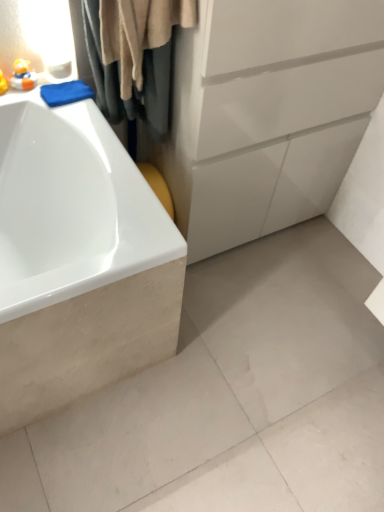
Question: Is white glossy bathtub at left looking in the opposite direction of matte yellow rubber duck at upper left, the first toy positioned from the left?

Choices:
 (A) yes
 (B) no

Answer: (B)

Question: From a real-world perspective, is white glossy bathtub at left over matte yellow rubber duck at upper left, the first toy positioned from the left?

Choices:
 (A) yes
 (B) no

Answer: (B)

Question: Is white glossy bathtub at left touching matte yellow rubber duck at upper left, the first toy positioned from the left?

Choices:
 (A) yes
 (B) no

Answer: (B)

Question: Is white glossy bathtub at left behind matte yellow rubber duck at upper left, positioned as the second toy in right-to-left order?

Choices:
 (A) yes
 (B) no

Answer: (B)

Question: Is white glossy bathtub at left positioned before matte yellow rubber duck at upper left, positioned as the second toy in right-to-left order?

Choices:
 (A) yes
 (B) no

Answer: (A)

Question: From a real-world perspective, relative to white glossy bathtub at left, is beige fabric shower curtain at upper left vertically above or below?

Choices:
 (A) below
 (B) above

Answer: (B)

Question: Which is correct: beige fabric shower curtain at upper left is inside white glossy bathtub at left, or outside of it?

Choices:
 (A) outside
 (B) inside

Answer: (A)

Question: Considering their positions, is beige fabric shower curtain at upper left located in front of or behind white glossy bathtub at left?

Choices:
 (A) behind
 (B) front

Answer: (A)

Question: Is beige fabric shower curtain at upper left wider or thinner than white glossy bathtub at left?

Choices:
 (A) wide
 (B) thin

Answer: (B)

Question: In the image, is beige fabric shower curtain at upper left on the left side or the right side of matte yellow rubber duck at upper left, which is the second toy in left-to-right order?

Choices:
 (A) left
 (B) right

Answer: (B)

Question: From a real-world perspective, is beige fabric shower curtain at upper left positioned above or below matte yellow rubber duck at upper left, which is the 1th toy from right to left?

Choices:
 (A) below
 (B) above

Answer: (B)

Question: Considering the positions of beige fabric shower curtain at upper left and matte yellow rubber duck at upper left, which is the second toy in left-to-right order, in the image, is beige fabric shower curtain at upper left wider or thinner than matte yellow rubber duck at upper left, which is the second toy in left-to-right order,?

Choices:
 (A) wide
 (B) thin

Answer: (A)

Question: Would you say beige fabric shower curtain at upper left is inside or outside matte yellow rubber duck at upper left, which is the 1th toy from right to left?

Choices:
 (A) inside
 (B) outside

Answer: (B)

Question: From a real-world perspective, is white matte concrete at lower left positioned above or below matte yellow rubber duck at upper left, which is the second toy in left-to-right order?

Choices:
 (A) above
 (B) below

Answer: (B)

Question: Considering the positions of white matte concrete at lower left and matte yellow rubber duck at upper left, which is the 1th toy from right to left, in the image, is white matte concrete at lower left taller or shorter than matte yellow rubber duck at upper left, which is the 1th toy from right to left,?

Choices:
 (A) tall
 (B) short

Answer: (B)